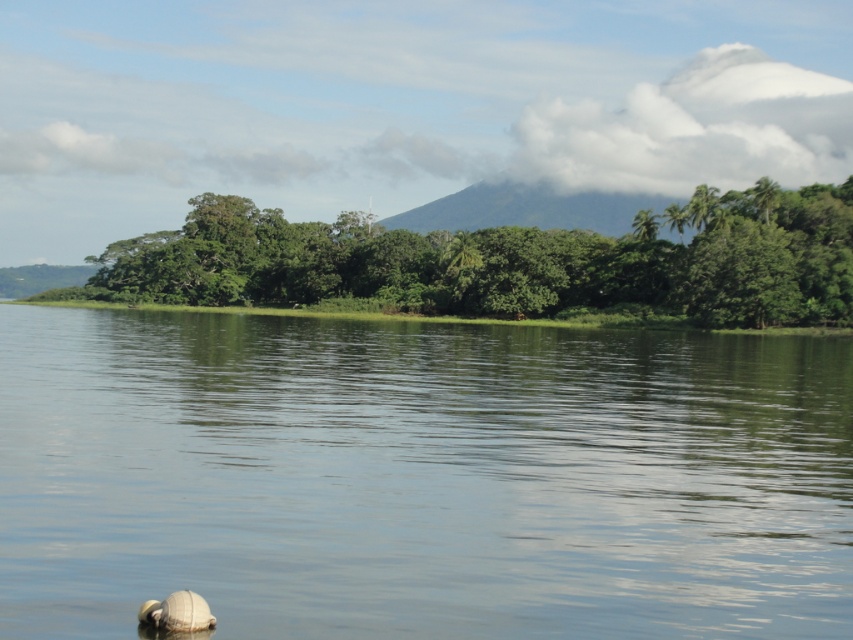
You are standing on the shore of the lake and see the green smooth water at center and the green leafy trees at center. Which object is located to the right side of the other?

The green smooth water at center is positioned on the right side of green leafy trees at center.

You are a photographer planning to capture the entire scene in one shot. Given that the green smooth water at center and green leafy trees at center are both in the frame, which object will require a wider angle to fully capture in your photo?

The green leafy trees at center require a wider angle because their width is greater than the green smooth water at center.